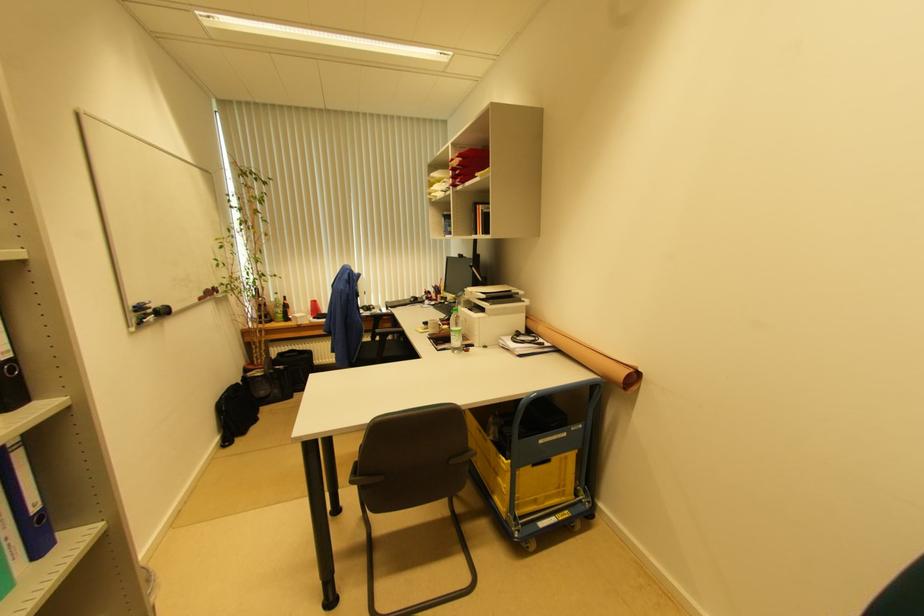
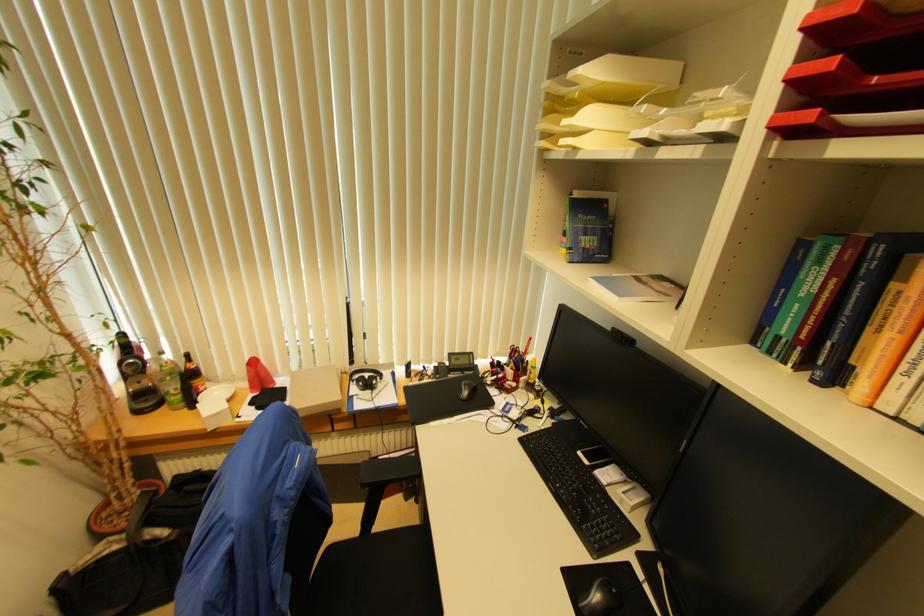
Question: The images are taken continuously from a first-person perspective. In which direction are you moving?

Choices:
 (A) Left
 (B) Right
 (C) Forward
 (D) Backward

Answer: (C)